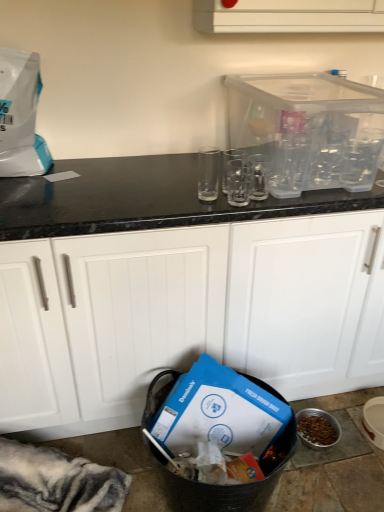
Locate an element on the screen. The height and width of the screenshot is (512, 384). free point to the right of clear glass at center, marked as the 1th clear in a right-to-left arrangement is located at coordinates (304, 202).